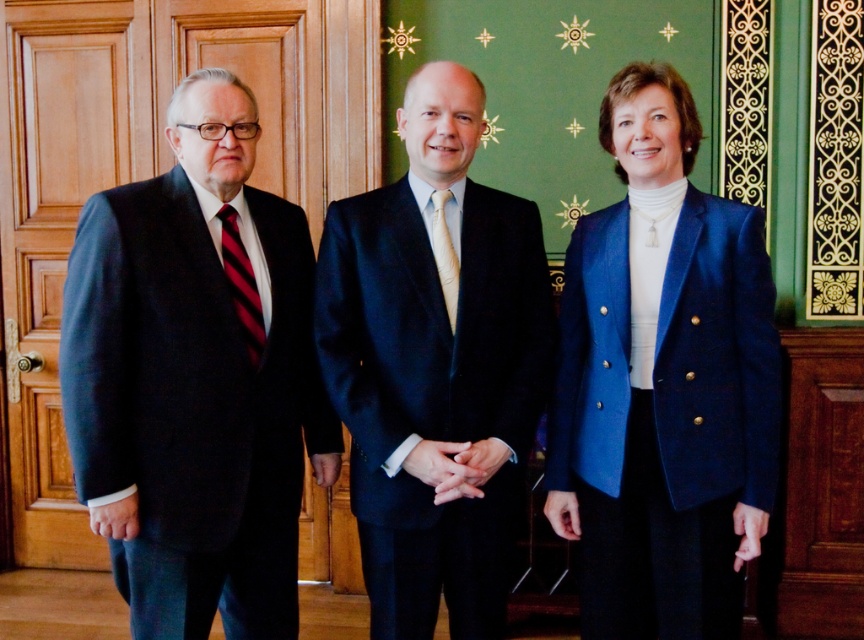
You are organizing a charity event and need to arrange the three people in order from tallest to shortest based on their clothing items. The blue woolen blazer at right and striped silk tie at left are visible. Which clothing item is taller?

The blue woolen blazer at right is taller than the striped silk tie at left.

You are a photographer preparing to take a group photo of the matte black suit at left and the blue woolen blazer at right. Considering their sizes, which of the two should be placed closer to the center to ensure both appear proportionally sized in the frame?

The matte black suit at left is wider than the blue woolen blazer at right, so to ensure both appear proportionally sized in the frame, the matte black suit at left should be placed closer to the center. This adjustment accounts for its larger width, helping balance the visual composition.

You are a photographer positioned in front of the three people. You need to capture a photo where both the matte black suit at left and the light beige silk tie at center are clearly visible. Which subject should you focus on first to ensure both are in focus?

You should focus on the matte black suit at left first because it is closer to the viewer than the light beige silk tie at center, so focusing on the closer object will ensure both are in focus.